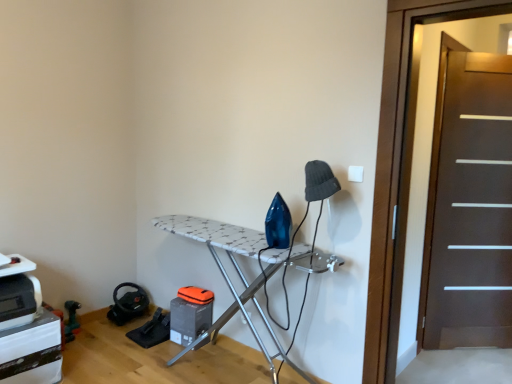
Where is `vacant space underneath white textured ironing board at center (from a real-world perspective)`? The width and height of the screenshot is (512, 384). vacant space underneath white textured ironing board at center (from a real-world perspective) is located at coordinates click(x=212, y=362).